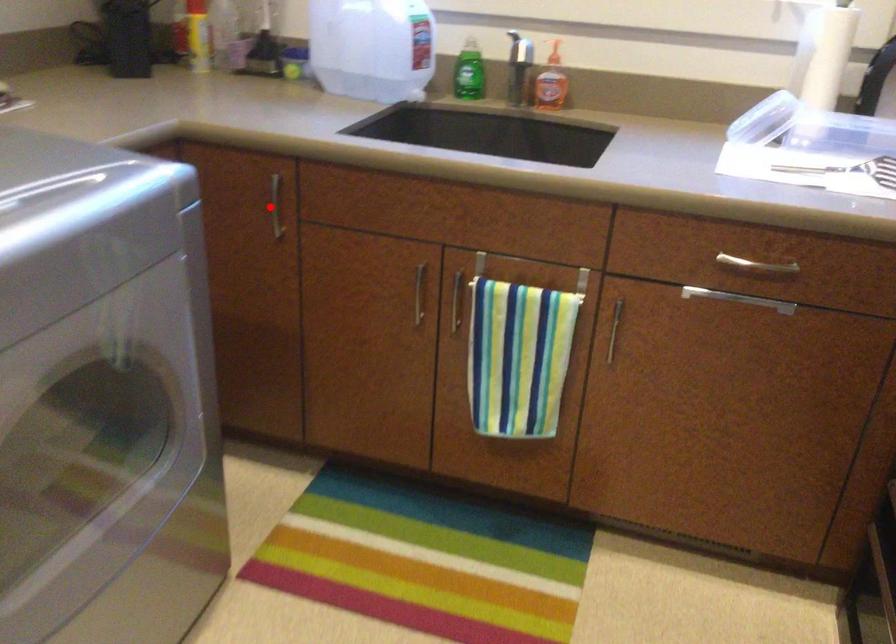
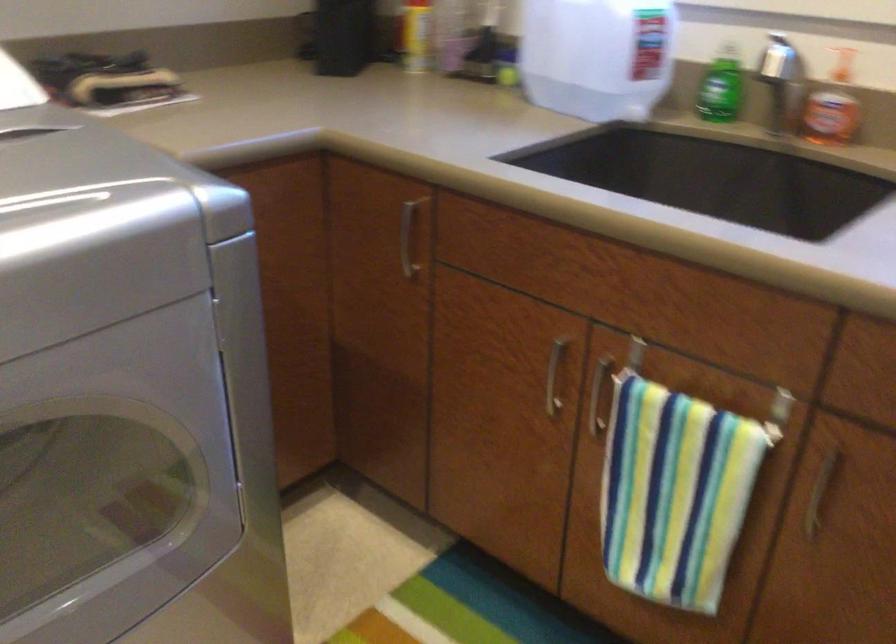
Question: I am providing you with two images of the same scene from different viewpoints. A red point is shown in image1. For the corresponding object point in image2, is it positioned nearer or farther from the camera?

Choices:
 (A) Nearer
 (B) Farther

Answer: (A)